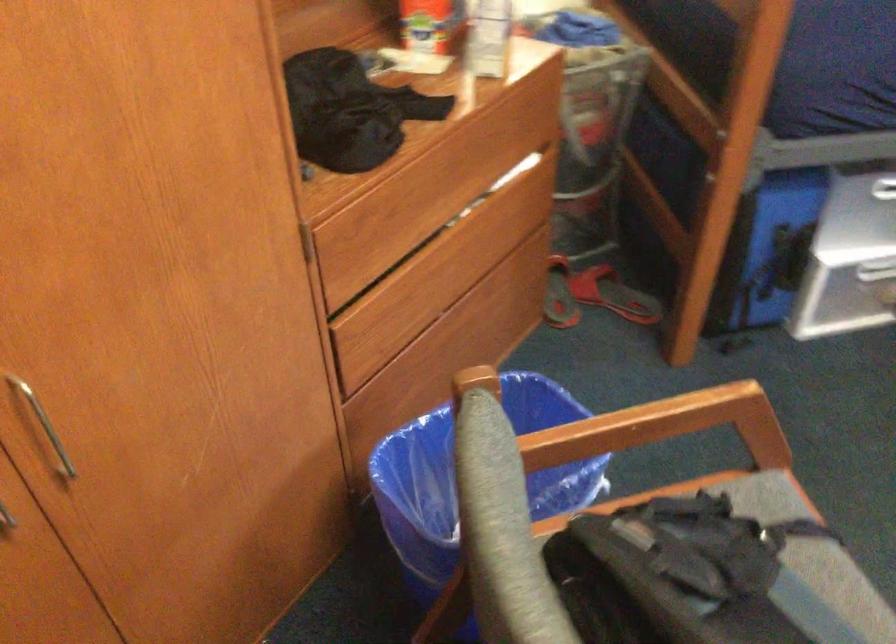
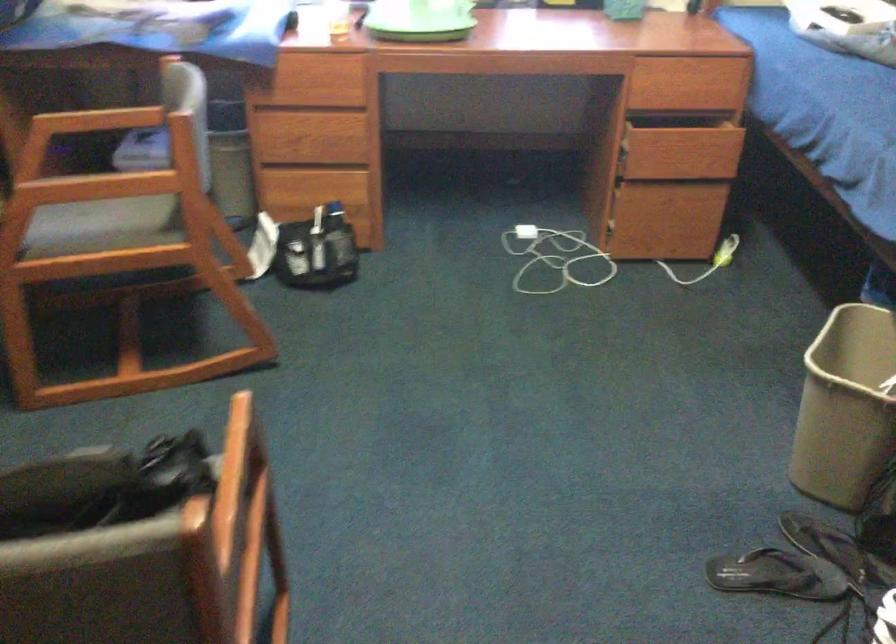
Consider the image. Based on the continuous images, in which direction is the camera rotating?

The rotation direction of the camera is right-down.